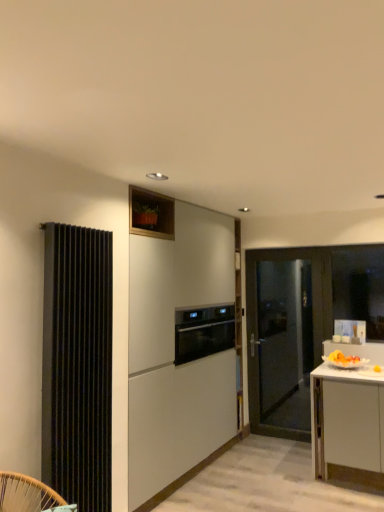
Question: Which is correct: satin black oven at center is inside matte black door at right, or outside of it?

Choices:
 (A) outside
 (B) inside

Answer: (A)

Question: From the image's perspective, is satin black oven at center positioned above or below matte black door at right?

Choices:
 (A) below
 (B) above

Answer: (B)

Question: Which is farther from the satin black oven at center?

Choices:
 (A) white matte cabinet at center
 (B) black ribbed radiator at left
 (C) matte black door at right
 (D) transparent glass window at right

Answer: (D)

Question: Which object is the closest to the satin black oven at center?

Choices:
 (A) matte black door at right
 (B) black ribbed radiator at left
 (C) transparent glass window at right
 (D) white matte cabinet at center

Answer: (D)